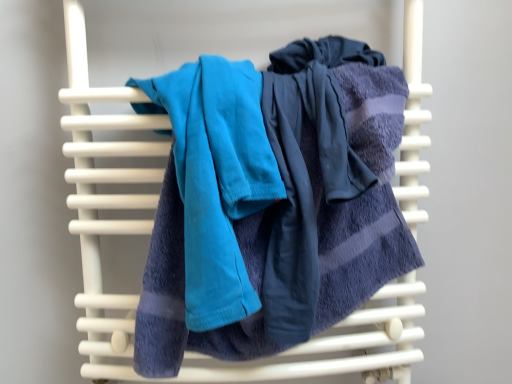
Find the location of a particular element. The height and width of the screenshot is (384, 512). soft blue towel at center, which ranks as the 2th towel in left-to-right order is located at coordinates (296, 212).

Measure the distance between soft blue towel at center, which ranks as the 2th towel in left-to-right order, and camera.

soft blue towel at center, which ranks as the 2th towel in left-to-right order, is 22.67 inches from camera.

The image size is (512, 384). What do you see at coordinates (296, 212) in the screenshot?
I see `soft blue towel at center, arranged as the first towel when viewed from the right` at bounding box center [296, 212].

What is the approximate width of soft blue towel at center, which ranks as the 2th towel in left-to-right order?

soft blue towel at center, which ranks as the 2th towel in left-to-right order, is 19.90 centimeters in width.

Where is `teal fabric towel at center, acting as the 2th towel starting from the right`? The width and height of the screenshot is (512, 384). teal fabric towel at center, acting as the 2th towel starting from the right is located at coordinates click(x=216, y=178).

This screenshot has height=384, width=512. What do you see at coordinates (216, 178) in the screenshot? I see `teal fabric towel at center, acting as the 2th towel starting from the right` at bounding box center [216, 178].

From the picture: What is the approximate height of teal fabric towel at center, acting as the 2th towel starting from the right?

The height of teal fabric towel at center, acting as the 2th towel starting from the right, is 15.08 inches.

Locate an element on the screen. The width and height of the screenshot is (512, 384). soft blue towel at center, arranged as the first towel when viewed from the right is located at coordinates (296, 212).

Considering the relative positions of teal fabric towel at center, acting as the 2th towel starting from the right, and soft blue towel at center, which ranks as the 2th towel in left-to-right order, in the image provided, is teal fabric towel at center, acting as the 2th towel starting from the right, to the right of soft blue towel at center, which ranks as the 2th towel in left-to-right order, from the viewer's perspective?

Incorrect, teal fabric towel at center, acting as the 2th towel starting from the right, is not on the right side of soft blue towel at center, which ranks as the 2th towel in left-to-right order.

Which is behind, teal fabric towel at center, the first towel in the left-to-right sequence, or soft blue towel at center, arranged as the first towel when viewed from the right?

soft blue towel at center, arranged as the first towel when viewed from the right, is behind.

Which is in front, point (201, 223) or point (278, 92)?

The point (201, 223) is closer.

From the image's perspective, is teal fabric towel at center, the first towel in the left-to-right sequence, beneath soft blue towel at center, arranged as the first towel when viewed from the right?

No, from the image's perspective, teal fabric towel at center, the first towel in the left-to-right sequence, is not below soft blue towel at center, arranged as the first towel when viewed from the right.

From a real-world perspective, is teal fabric towel at center, the first towel in the left-to-right sequence, under soft blue towel at center, which ranks as the 2th towel in left-to-right order?

No, from a real-world perspective, teal fabric towel at center, the first towel in the left-to-right sequence, is not below soft blue towel at center, which ranks as the 2th towel in left-to-right order.

Between teal fabric towel at center, the first towel in the left-to-right sequence, and soft blue towel at center, which ranks as the 2th towel in left-to-right order, which one has smaller width?

With smaller width is teal fabric towel at center, the first towel in the left-to-right sequence.

In terms of height, does teal fabric towel at center, the first towel in the left-to-right sequence, look taller or shorter compared to soft blue towel at center, arranged as the first towel when viewed from the right?

Clearly, teal fabric towel at center, the first towel in the left-to-right sequence, is shorter compared to soft blue towel at center, arranged as the first towel when viewed from the right.

Does teal fabric towel at center, acting as the 2th towel starting from the right, have a smaller size compared to soft blue towel at center, which ranks as the 2th towel in left-to-right order?

Yes.

Is teal fabric towel at center, acting as the 2th towel starting from the right, positioned beyond the bounds of soft blue towel at center, which ranks as the 2th towel in left-to-right order?

No, teal fabric towel at center, acting as the 2th towel starting from the right, is not outside of soft blue towel at center, which ranks as the 2th towel in left-to-right order.

Are teal fabric towel at center, acting as the 2th towel starting from the right, and soft blue towel at center, which ranks as the 2th towel in left-to-right order, far apart?

No, teal fabric towel at center, acting as the 2th towel starting from the right, is in close proximity to soft blue towel at center, which ranks as the 2th towel in left-to-right order.

Is teal fabric towel at center, the first towel in the left-to-right sequence, positioned with its back to soft blue towel at center, arranged as the first towel when viewed from the right?

Yes, teal fabric towel at center, the first towel in the left-to-right sequence, is positioned with its back facing soft blue towel at center, arranged as the first towel when viewed from the right.

What's the angular difference between teal fabric towel at center, the first towel in the left-to-right sequence, and soft blue towel at center, arranged as the first towel when viewed from the right,'s facing directions?

The angular difference between teal fabric towel at center, the first towel in the left-to-right sequence, and soft blue towel at center, arranged as the first towel when viewed from the right, is 6.72e-05 degrees.

Could you measure the distance between teal fabric towel at center, acting as the 2th towel starting from the right, and soft blue towel at center, arranged as the first towel when viewed from the right?

teal fabric towel at center, acting as the 2th towel starting from the right, and soft blue towel at center, arranged as the first towel when viewed from the right, are 8.69 centimeters apart from each other.

Where is `towel positioned vertically above the soft blue towel at center, which ranks as the 2th towel in left-to-right order (from a real-world perspective)`? This screenshot has height=384, width=512. towel positioned vertically above the soft blue towel at center, which ranks as the 2th towel in left-to-right order (from a real-world perspective) is located at coordinates (216, 178).

Is soft blue towel at center, arranged as the first towel when viewed from the right, to the left of teal fabric towel at center, the first towel in the left-to-right sequence, from the viewer's perspective?

Incorrect, soft blue towel at center, arranged as the first towel when viewed from the right, is not on the left side of teal fabric towel at center, the first towel in the left-to-right sequence.

In the image, is soft blue towel at center, arranged as the first towel when viewed from the right, positioned in front of or behind teal fabric towel at center, acting as the 2th towel starting from the right?

In the image, soft blue towel at center, arranged as the first towel when viewed from the right, appears behind teal fabric towel at center, acting as the 2th towel starting from the right.

Does point (187, 340) come farther from viewer compared to point (193, 238)?

Yes.

From the image's perspective, is soft blue towel at center, arranged as the first towel when viewed from the right, located beneath teal fabric towel at center, the first towel in the left-to-right sequence?

Indeed, from the image's perspective, soft blue towel at center, arranged as the first towel when viewed from the right, is shown beneath teal fabric towel at center, the first towel in the left-to-right sequence.

From a real-world perspective, which object rests below the other?

From a 3D spatial view, soft blue towel at center, which ranks as the 2th towel in left-to-right order, is below.

In the scene shown: Considering the sizes of objects soft blue towel at center, arranged as the first towel when viewed from the right, and teal fabric towel at center, the first towel in the left-to-right sequence, in the image provided, who is wider, soft blue towel at center, arranged as the first towel when viewed from the right, or teal fabric towel at center, the first towel in the left-to-right sequence,?

With larger width is soft blue towel at center, arranged as the first towel when viewed from the right.

Does soft blue towel at center, which ranks as the 2th towel in left-to-right order, have a lesser height compared to teal fabric towel at center, acting as the 2th towel starting from the right?

Incorrect, the height of soft blue towel at center, which ranks as the 2th towel in left-to-right order, does not fall short of that of teal fabric towel at center, acting as the 2th towel starting from the right.

Considering the sizes of soft blue towel at center, which ranks as the 2th towel in left-to-right order, and teal fabric towel at center, the first towel in the left-to-right sequence, in the image, is soft blue towel at center, which ranks as the 2th towel in left-to-right order, bigger or smaller than teal fabric towel at center, the first towel in the left-to-right sequence,?

Clearly, soft blue towel at center, which ranks as the 2th towel in left-to-right order, is larger in size than teal fabric towel at center, the first towel in the left-to-right sequence.

Is soft blue towel at center, which ranks as the 2th towel in left-to-right order, situated inside teal fabric towel at center, acting as the 2th towel starting from the right, or outside?

soft blue towel at center, which ranks as the 2th towel in left-to-right order, is not enclosed by teal fabric towel at center, acting as the 2th towel starting from the right.

Is there a large distance between soft blue towel at center, arranged as the first towel when viewed from the right, and teal fabric towel at center, the first towel in the left-to-right sequence?

That's not correct — soft blue towel at center, arranged as the first towel when viewed from the right, is a little close to teal fabric towel at center, the first towel in the left-to-right sequence.

Is soft blue towel at center, which ranks as the 2th towel in left-to-right order, aimed at teal fabric towel at center, acting as the 2th towel starting from the right?

Yes.

Could you measure the distance between soft blue towel at center, which ranks as the 2th towel in left-to-right order, and teal fabric towel at center, acting as the 2th towel starting from the right?

3.42 inches.

Find the location of a particular element. towel lying behind the teal fabric towel at center, acting as the 2th towel starting from the right is located at coordinates (296, 212).

The image size is (512, 384). I want to click on towel lying on the left of soft blue towel at center, which ranks as the 2th towel in left-to-right order, so click(x=216, y=178).

Where is `towel located above the soft blue towel at center, arranged as the first towel when viewed from the right (from the image's perspective)`? The height and width of the screenshot is (384, 512). towel located above the soft blue towel at center, arranged as the first towel when viewed from the right (from the image's perspective) is located at coordinates (216, 178).